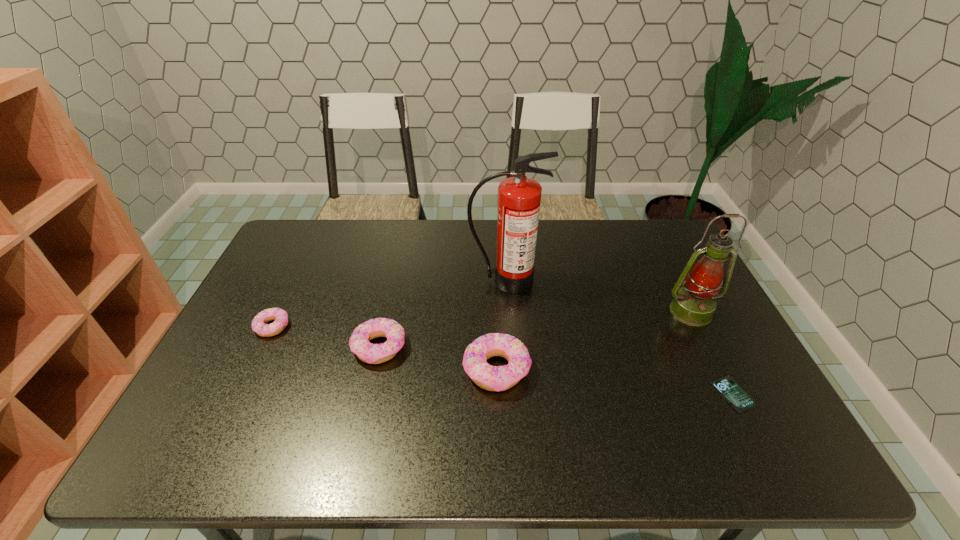
Where is `the leftmost object`? Image resolution: width=960 pixels, height=540 pixels. the leftmost object is located at coordinates pyautogui.click(x=259, y=325).

Where is `the fifth tallest object`? the fifth tallest object is located at coordinates click(259, 325).

The height and width of the screenshot is (540, 960). What are the coordinates of `the third shortest object` in the screenshot? It's located at (359, 342).

Find the location of a particular element. The image size is (960, 540). the second object from left to right is located at coordinates (359, 342).

This screenshot has height=540, width=960. Identify the location of the rightmost doughnut. tap(491, 378).

This screenshot has height=540, width=960. In order to click on oil lamp in this screenshot , I will do `click(694, 305)`.

Find the location of a particular element. This screenshot has height=540, width=960. the shortest object is located at coordinates (726, 385).

You are a GUI agent. You are given a task and a screenshot of the screen. Output one action in this format:
    pyautogui.click(x=<x>, y=<y>)
    Task: Click on the fire extinguisher
    This screenshot has width=960, height=540.
    Given the screenshot: What is the action you would take?
    pyautogui.click(x=519, y=197)

You are a GUI agent. You are given a task and a screenshot of the screen. Output one action in this format:
    pyautogui.click(x=<x>, y=<y>)
    Task: Click on the farthest object
    This screenshot has height=540, width=960.
    Given the screenshot: What is the action you would take?
    pyautogui.click(x=519, y=197)

Locate an element on the screen. Image resolution: width=960 pixels, height=540 pixels. vacant region located on the back of the leftmost doughnut is located at coordinates [x=306, y=255].